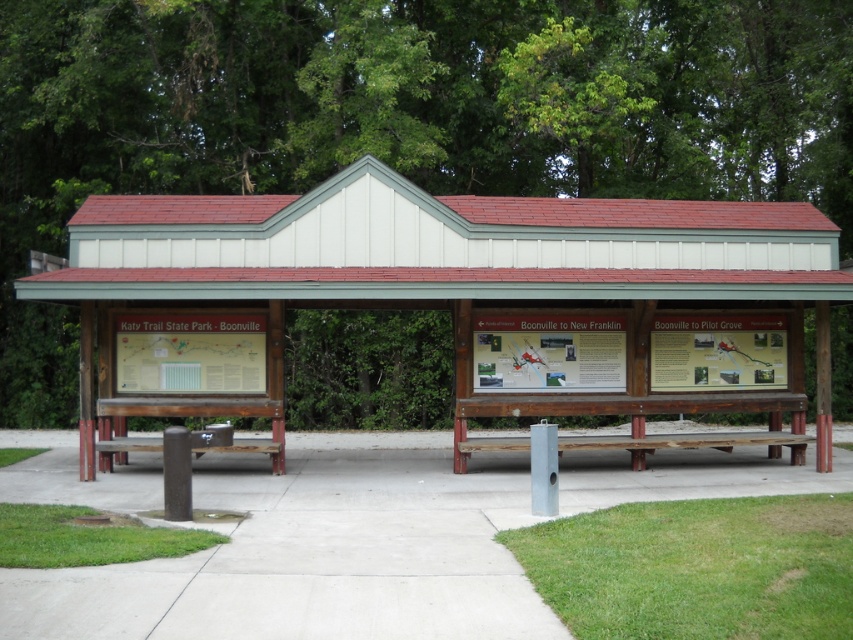
You are standing in front of the informational shelter and notice two points marked on its front wall. The first point is at coordinates point (456, 252) and the second is at point (231, 621). Which of these points is closer to you?

Point (456, 252) is further to the viewer than point (231, 621), so the second point is closer to you.